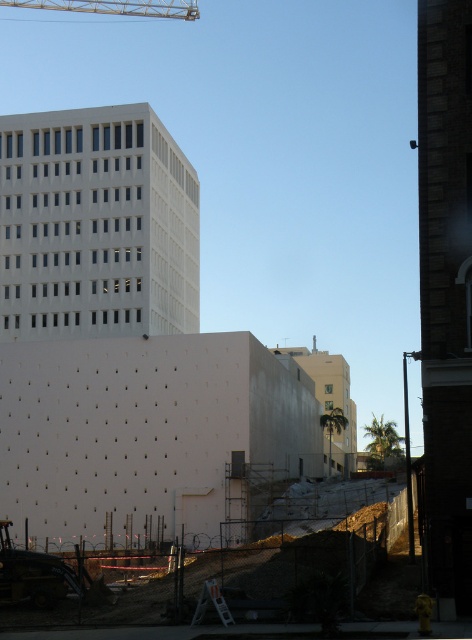
Question: In this image, where is white smooth building at upper left located relative to yellow metallic crane at upper left?

Choices:
 (A) below
 (B) above

Answer: (A)

Question: Which object appears farthest from the camera in this image?

Choices:
 (A) yellow metallic crane at upper left
 (B) white smooth building at upper left

Answer: (A)

Question: Among these objects, which one is nearest to the camera?

Choices:
 (A) white smooth building at upper left
 (B) yellow metallic crane at upper left

Answer: (A)

Question: Does white smooth building at upper left lie behind yellow metallic crane at upper left?

Choices:
 (A) yes
 (B) no

Answer: (B)

Question: Is white smooth building at upper left above yellow metallic crane at upper left?

Choices:
 (A) yes
 (B) no

Answer: (B)